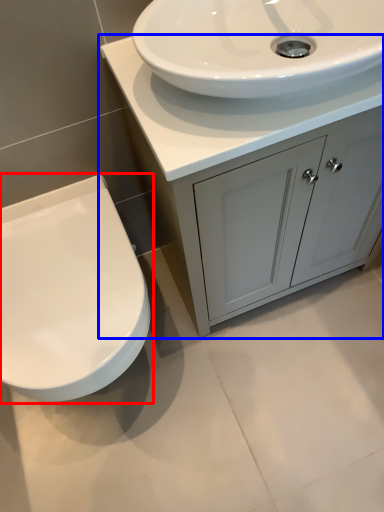
Question: Among these objects, which one is nearest to the camera, toilet (highlighted by a red box) or bathroom cabinet (highlighted by a blue box)?

Choices:
 (A) toilet
 (B) bathroom cabinet

Answer: (B)